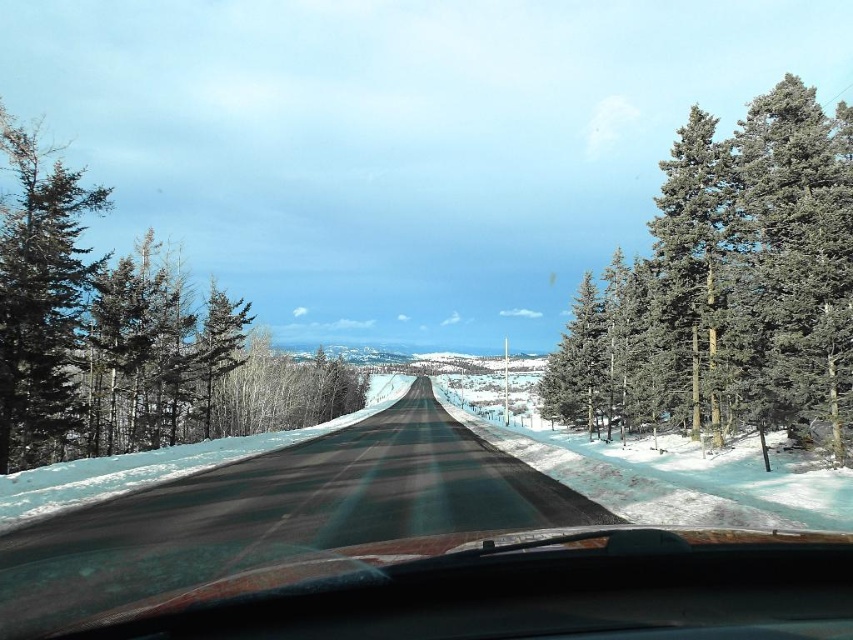
You are driving a car and notice two trees on the left side of the road. Which one is larger in size between the green textured pine tree at left and the green matte tree at left?

The green textured pine tree at left is bigger than the green matte tree at left.

You are driving a car that is 5 meters long. You see the green textured pine tree at left and the green matte tree at left from your current position. Can your car fit between them without moving sideways?

The distance between the green textured pine tree at left and the green matte tree at left is 67.40 meters. Since your car is only 5 meters long, it can easily fit between them without moving sideways.

You are driving a car and looking through the windshield. You see two points marked on the road ahead. The first point is at coordinate point(734,282) and the second is at point(78,179). Which point is closer to your car?

Point(78,179) is closer to your car because it is positioned closer to the camera than point(734,282).